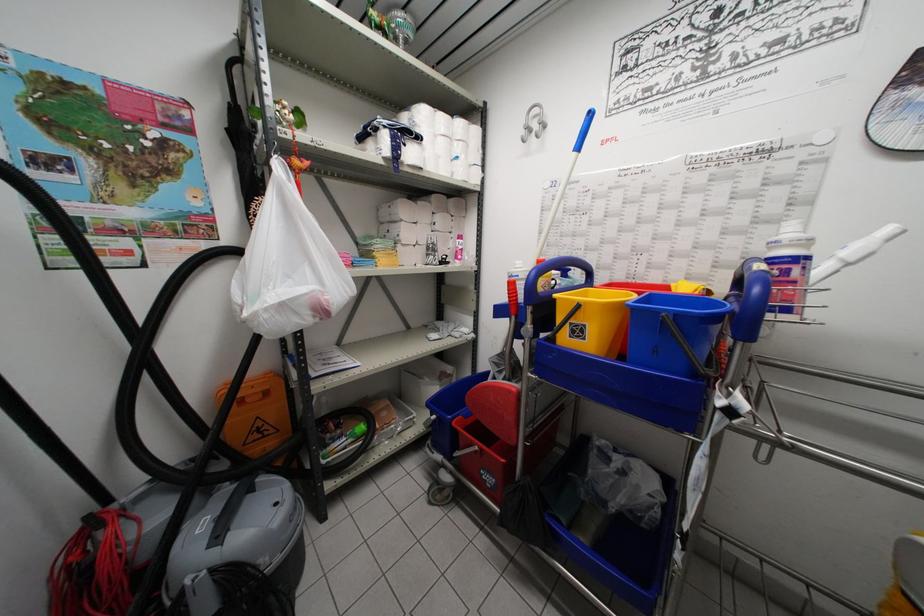
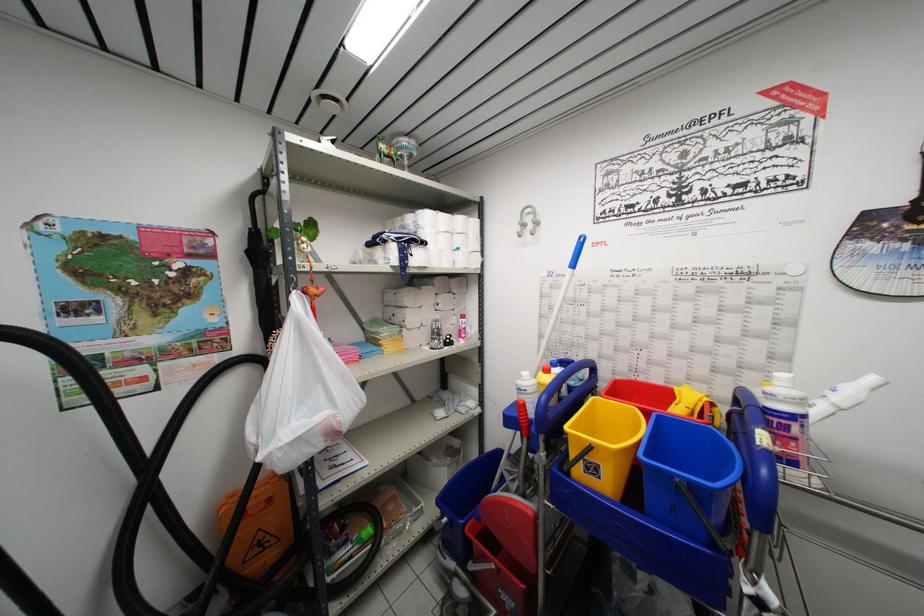
Locate, in the second image, the point that corresponds to the point at 232,135 in the first image.

(250, 257)